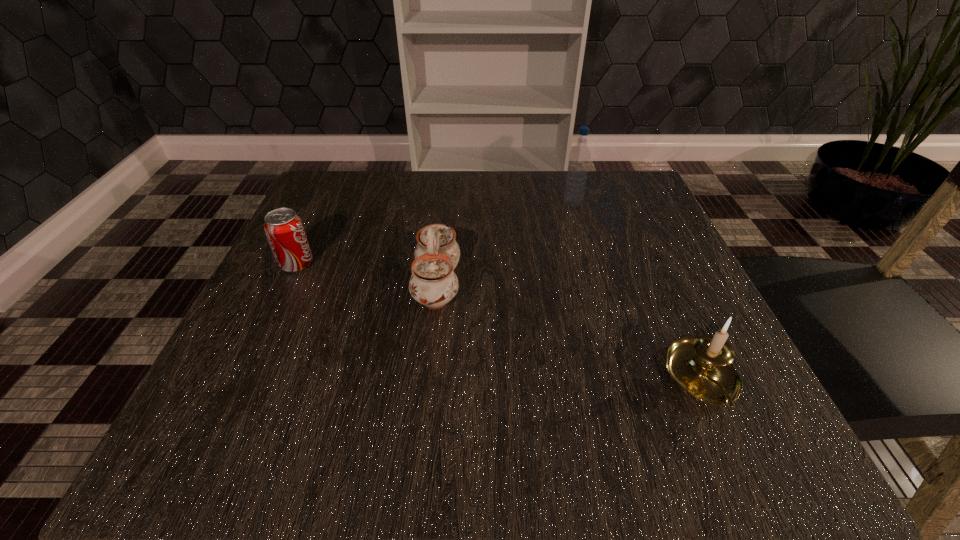
Locate an element on the screen. This screenshot has width=960, height=540. object situated at the near edge is located at coordinates (703, 366).

This screenshot has width=960, height=540. I want to click on object at the left edge, so click(x=285, y=232).

Where is `water bottle situated at the right edge`? Image resolution: width=960 pixels, height=540 pixels. water bottle situated at the right edge is located at coordinates (579, 157).

You are a GUI agent. You are given a task and a screenshot of the screen. Output one action in this format:
    pyautogui.click(x=<x>, y=<y>)
    Task: Click on the candle holder at the right edge
    
    Given the screenshot: What is the action you would take?
    pyautogui.click(x=703, y=366)

Image resolution: width=960 pixels, height=540 pixels. Identify the location of object that is at the far right corner. tap(579, 157).

Where is `object that is at the near right corner`? Image resolution: width=960 pixels, height=540 pixels. object that is at the near right corner is located at coordinates (703, 366).

The image size is (960, 540). In the image, there is a desktop. What are the coordinates of `free space at the far edge` in the screenshot? It's located at click(x=564, y=179).

Image resolution: width=960 pixels, height=540 pixels. I want to click on vacant space at the near edge, so click(x=517, y=449).

You are a GUI agent. You are given a task and a screenshot of the screen. Output one action in this format:
    pyautogui.click(x=<x>, y=<y>)
    Task: Click on the vacant space at the left edge of the desktop
    The width and height of the screenshot is (960, 540).
    Given the screenshot: What is the action you would take?
    pyautogui.click(x=326, y=300)

Where is `free space at the right edge of the desktop`? The image size is (960, 540). free space at the right edge of the desktop is located at coordinates (681, 286).